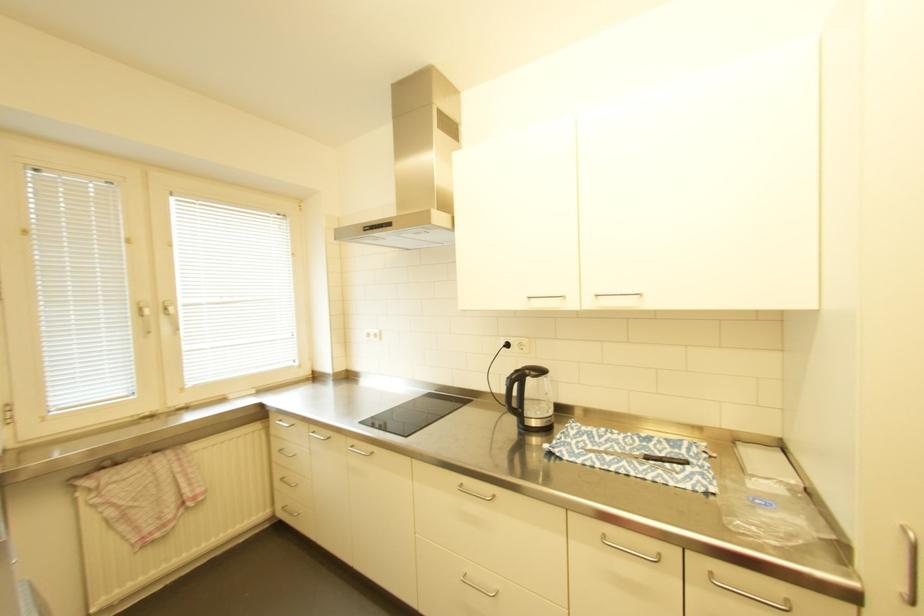
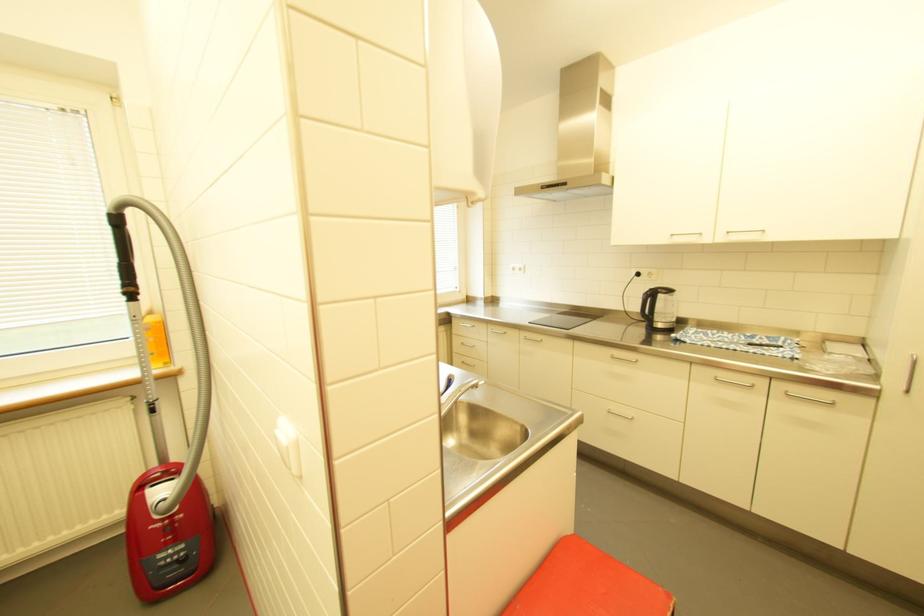
In a continuous first-person perspective shot, in which direction is the camera moving?

The cameraman moved toward left, backward.